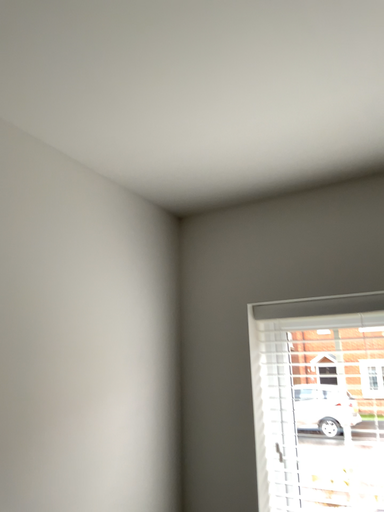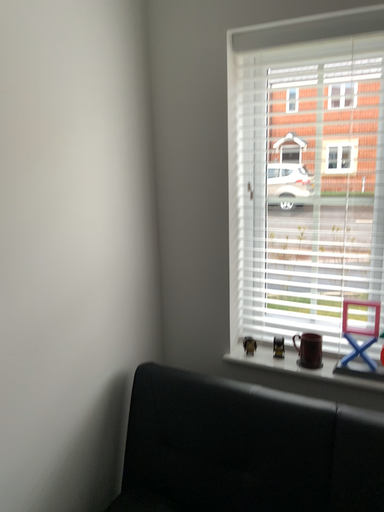
Question: Which way did the camera rotate in the video?

Choices:
 (A) rotated upward
 (B) rotated downward

Answer: (B)